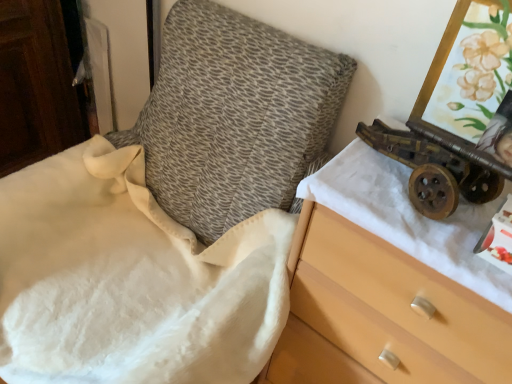
Question: Is wooden chest of drawers at right a part of rusty metal cannon at right?

Choices:
 (A) no
 (B) yes

Answer: (A)

Question: Does rusty metal cannon at right have a lesser height compared to wooden chest of drawers at right?

Choices:
 (A) yes
 (B) no

Answer: (A)

Question: Does rusty metal cannon at right come in front of wooden chest of drawers at right?

Choices:
 (A) yes
 (B) no

Answer: (B)

Question: Considering the relative positions of rusty metal cannon at right and wooden chest of drawers at right in the image provided, is rusty metal cannon at right to the left of wooden chest of drawers at right from the viewer's perspective?

Choices:
 (A) yes
 (B) no

Answer: (A)

Question: Is rusty metal cannon at right turned away from wooden chest of drawers at right?

Choices:
 (A) yes
 (B) no

Answer: (B)

Question: From a real-world perspective, is rusty metal cannon at right physically located above or below wooden chest of drawers at right?

Choices:
 (A) above
 (B) below

Answer: (A)

Question: Is rusty metal cannon at right to the left or to the right of wooden chest of drawers at right in the image?

Choices:
 (A) left
 (B) right

Answer: (A)

Question: Is rusty metal cannon at right bigger or smaller than wooden chest of drawers at right?

Choices:
 (A) big
 (B) small

Answer: (B)

Question: Is rusty metal cannon at right inside or outside of wooden chest of drawers at right?

Choices:
 (A) outside
 (B) inside

Answer: (A)

Question: In terms of width, does wooden chest of drawers at right look wider or thinner when compared to rusty metal cannon at right?

Choices:
 (A) thin
 (B) wide

Answer: (B)

Question: From their relative heights in the image, would you say wooden chest of drawers at right is taller or shorter than rusty metal cannon at right?

Choices:
 (A) short
 (B) tall

Answer: (B)

Question: In the image, is wooden chest of drawers at right on the left side or the right side of rusty metal cannon at right?

Choices:
 (A) left
 (B) right

Answer: (B)

Question: Would you say wooden chest of drawers at right is inside or outside rusty metal cannon at right?

Choices:
 (A) inside
 (B) outside

Answer: (B)

Question: Is wooden drawer at right wider or thinner than rusty metal cannon at right?

Choices:
 (A) thin
 (B) wide

Answer: (B)

Question: Is wooden drawer at right situated inside rusty metal cannon at right or outside?

Choices:
 (A) inside
 (B) outside

Answer: (B)